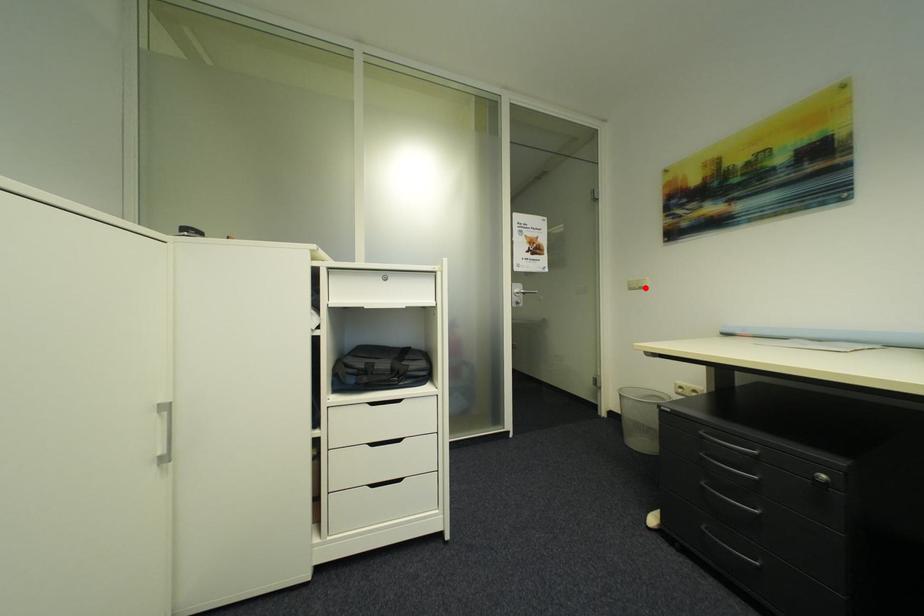
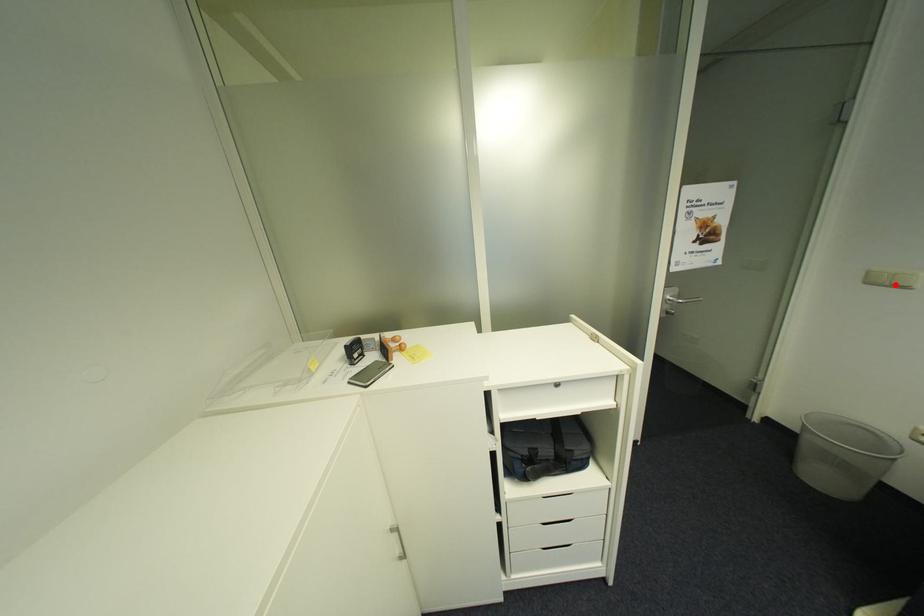
I am providing you with two images of the same scene from different viewpoints. A red point is marked on the first image and another point is marked on the second image. Are the points marked in image1 and image2 representing the same 3D position?

Yes